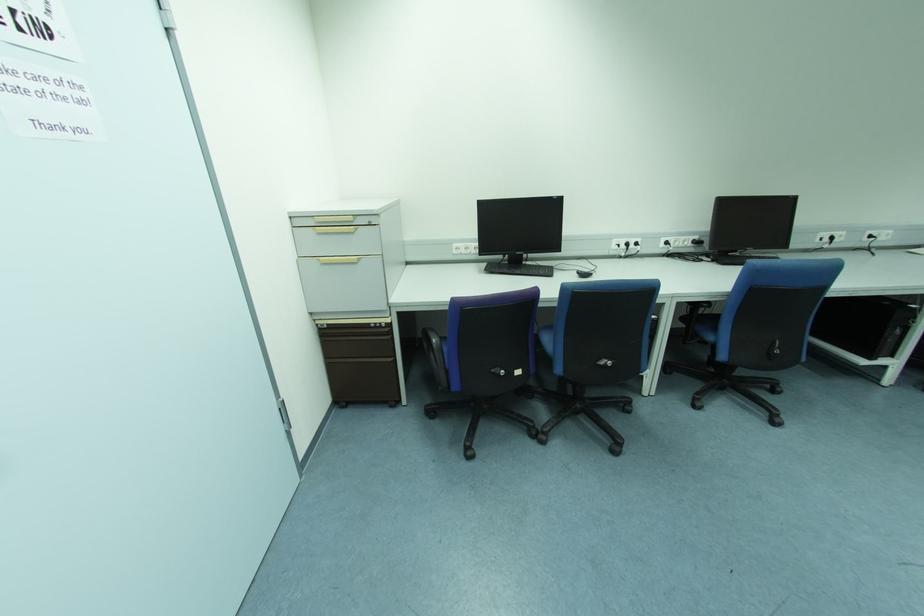
What do you see at coordinates (432, 344) in the screenshot? The height and width of the screenshot is (616, 924). I see `the black chair armrest` at bounding box center [432, 344].